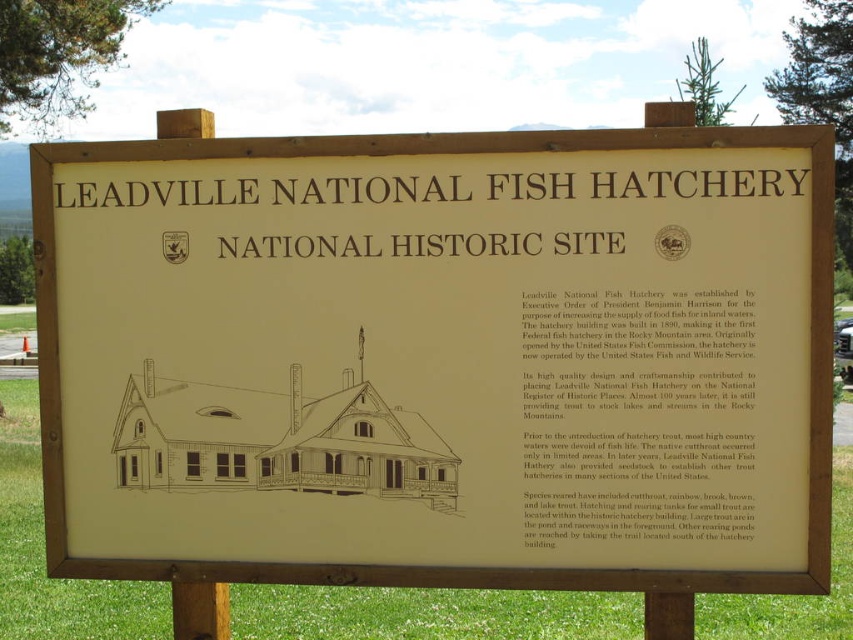
Looking at this image, does matte paper text at center appear under beige/wooden sign at upper center?

Yes, matte paper text at center is below beige/wooden sign at upper center.

This screenshot has height=640, width=853. What do you see at coordinates (637, 413) in the screenshot?
I see `matte paper text at center` at bounding box center [637, 413].

Locate an element on the screen. The height and width of the screenshot is (640, 853). matte paper text at center is located at coordinates (637, 413).

Does beige paper sign at center have a greater height compared to matte paper text at center?

Indeed, beige paper sign at center has a greater height compared to matte paper text at center.

Between point (256, 260) and point (585, 385), which one is positioned behind?

Positioned behind is point (256, 260).

The height and width of the screenshot is (640, 853). I want to click on beige paper sign at center, so click(440, 358).

Which is more to the right, beige paper sign at center or beige/wooden sign at upper center?

From the viewer's perspective, beige/wooden sign at upper center appears more on the right side.

Who is taller, beige paper sign at center or beige/wooden sign at upper center?

beige paper sign at center is taller.

Is point (160, 196) closer to viewer compared to point (413, 250)?

No, it is behind (413, 250).

I want to click on beige paper sign at center, so click(x=440, y=358).